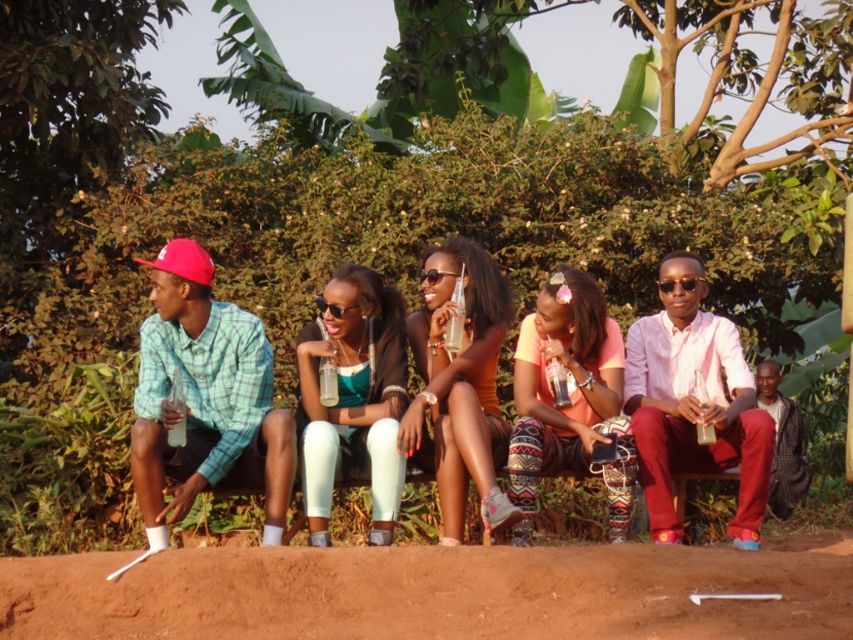
Does brown dirt track at lower center have a greater width compared to orange cotton shirt at center?

Yes.

Who is taller, brown dirt track at lower center or orange cotton shirt at center?

orange cotton shirt at center is taller.

What do you see at coordinates (436, 592) in the screenshot?
I see `brown dirt track at lower center` at bounding box center [436, 592].

Identify the location of brown dirt track at lower center. This screenshot has height=640, width=853. (436, 592).

Does brown dirt track at lower center have a lesser height compared to matte orange tank top at center?

Correct, brown dirt track at lower center is not as tall as matte orange tank top at center.

Can you confirm if brown dirt track at lower center is taller than matte orange tank top at center?

Incorrect, brown dirt track at lower center's height is not larger of matte orange tank top at center's.

Locate an element on the screen. The height and width of the screenshot is (640, 853). brown dirt track at lower center is located at coordinates (436, 592).

In the scene shown: Can you confirm if teal leggings at center is smaller than matte orange tank top at center?

Yes, teal leggings at center is smaller than matte orange tank top at center.

Does teal leggings at center appear under matte orange tank top at center?

Correct, teal leggings at center is located below matte orange tank top at center.

This screenshot has height=640, width=853. Describe the element at coordinates (352, 397) in the screenshot. I see `teal leggings at center` at that location.

At what (x,y) coordinates should I click in order to perform the action: click on teal leggings at center. Please return your answer as a coordinate pair (x, y). The image size is (853, 640). Looking at the image, I should click on (352, 397).